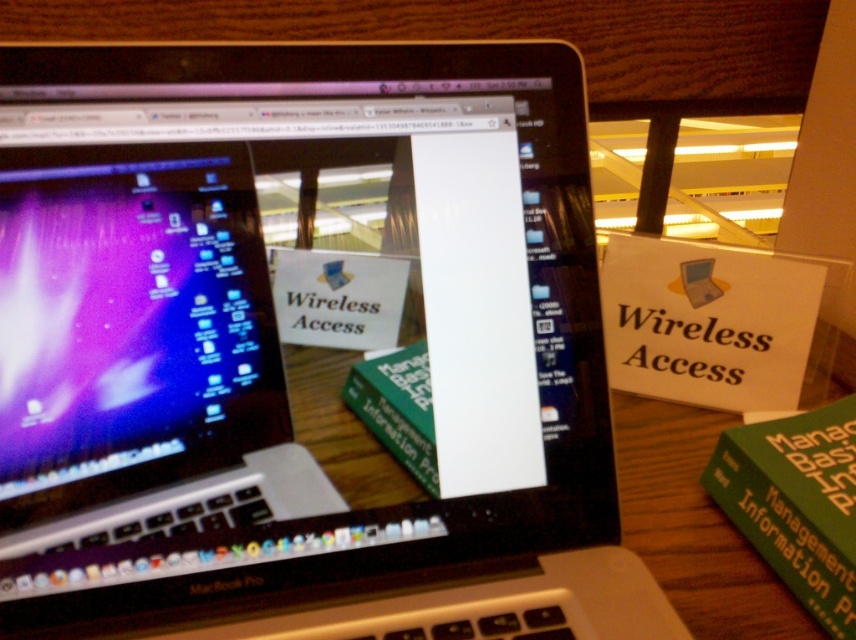
Does matte black laptop at left appear on the right side of green matte book at lower right?

Incorrect, matte black laptop at left is not on the right side of green matte book at lower right.

Can you confirm if matte black laptop at left is smaller than green matte book at lower right?

Yes, matte black laptop at left is smaller than green matte book at lower right.

Measure the distance between point (214, 292) and camera.

Point (214, 292) is 15.84 inches away from camera.

Identify the location of matte black laptop at left. Image resolution: width=856 pixels, height=640 pixels. (129, 323).